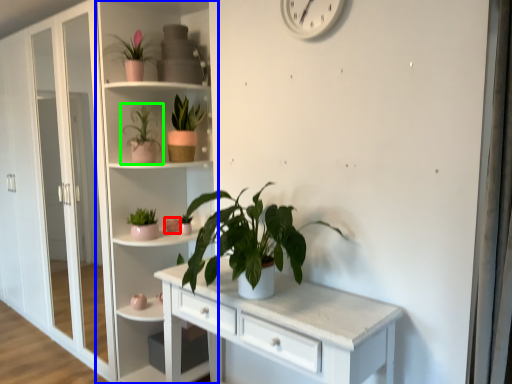
Question: Which is nearer to the flower (highlighted by a red box)? bookshelf (highlighted by a blue box) or houseplant (highlighted by a green box).

Choices:
 (A) bookshelf
 (B) houseplant

Answer: (B)